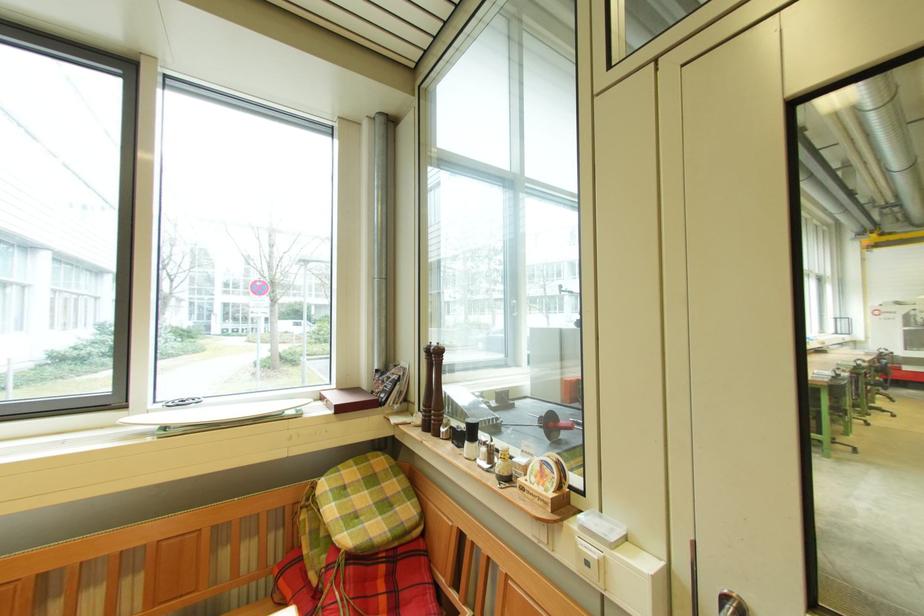
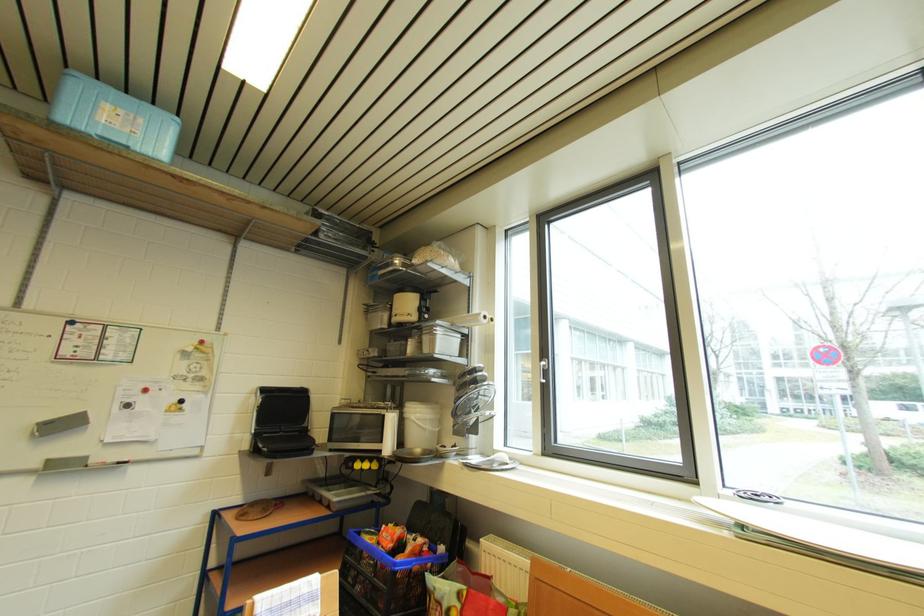
Question: The camera is either moving clockwise (left) or counter-clockwise (right) around the object. The first image is from the beginning of the video and the second image is from the end. Is the camera moving left or right when shooting the video?

Choices:
 (A) Left
 (B) Right

Answer: (B)